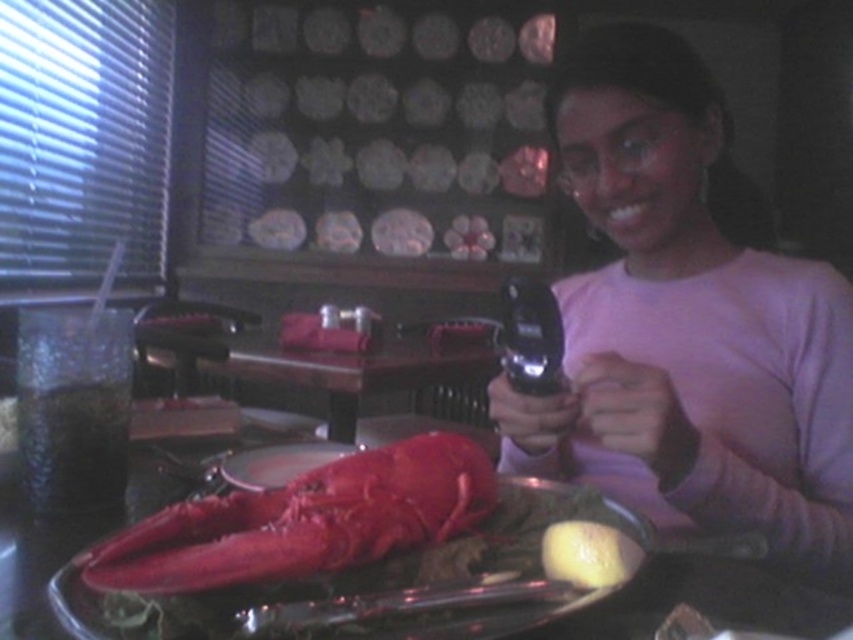
You are a photographer trying to capture the shiny red lobster at center and the yellow matte lemon at lower center in a single shot. Based on their sizes, which object will appear larger in the photo?

The shiny red lobster at center will appear much larger in the photo because it is much taller than the yellow matte lemon at lower center.

You are a photographer trying to capture a closeup shot of the shiny red lobster at center. You have a pink matte phone at upper right. Considering their sizes, which object would be easier to hold steady while taking the photo?

The pink matte phone at upper right would be easier to hold steady because it has a larger size compared to the shiny red lobster at center, making it more stable in your hand.

You are a photographer trying to capture the shiny red lobster at center and the yellow matte lemon at lower center in the same frame. Based on their positions, which object should you adjust your camera angle to focus on first to ensure both are in the shot?

The shiny red lobster at center is to the left of the yellow matte lemon at lower center. To capture both in the frame, focus on the shiny red lobster at center first since it is positioned further left, then adjust the camera to include the yellow matte lemon at lower center on the right side.